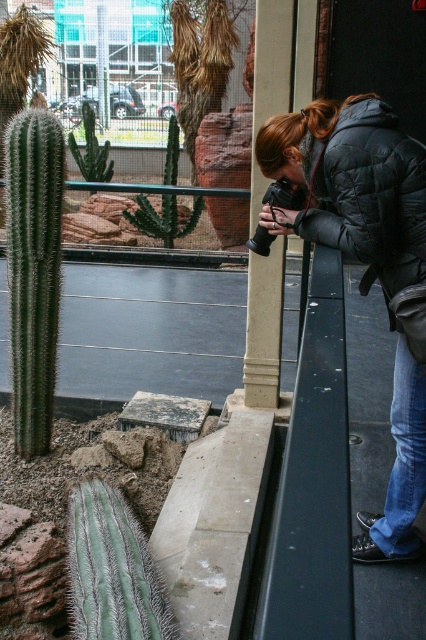
You are standing in front of the glass barrier and want to take a photo of the green spiky cactus at center. However, you notice the black quilted jacket at upper right might be blocking your view. Can you tell which object is taller, and therefore more likely to block the view?

The black quilted jacket at upper right is much taller than the green spiky cactus at center, so it is more likely to block the view.

You are standing in front of a glass barrier with a camera, trying to take a photo of the cacti display. There is a point marked at coordinates [365,260] which indicates the location of the black quilted jacket at upper right. Based on this information, where should you position your camera to avoid capturing the black quilted jacket at upper right in your photo?

To avoid capturing the black quilted jacket at upper right, position your camera away from the area indicated by the point at coordinates [365,260], ensuring the jacket is outside the frame.